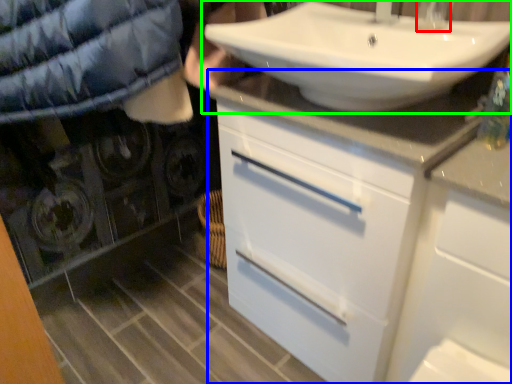
Question: Which is nearer to the faucet (highlighted by a red box)? bathroom cabinet (highlighted by a blue box) or sink (highlighted by a green box).

Choices:
 (A) bathroom cabinet
 (B) sink

Answer: (B)